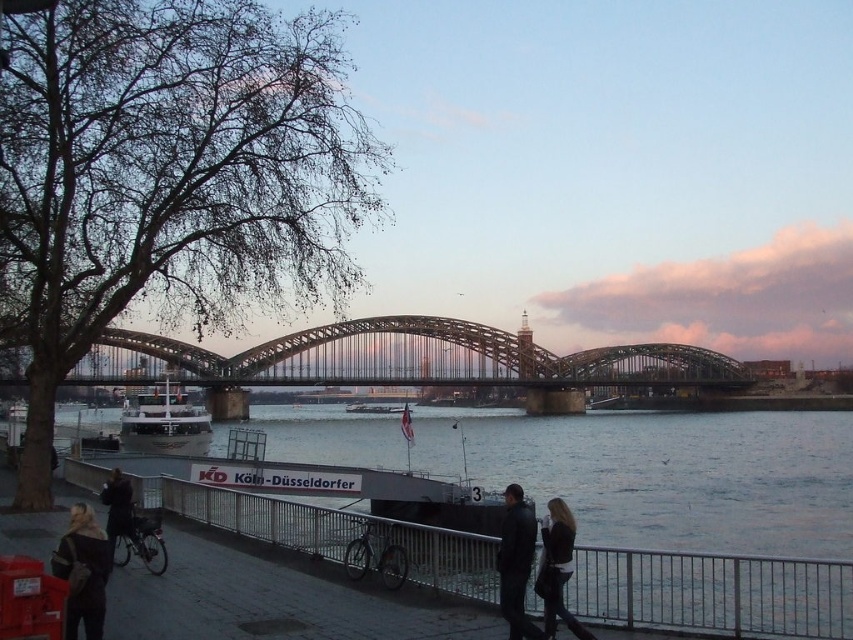
Question: Among these objects, which one is farthest from the camera?

Choices:
 (A) brown fur coat at lower left
 (B) metallic steel bridge at center
 (C) white glossy boat at center

Answer: (C)

Question: Does blue water at lower center appear over shiny silver boat at center?

Choices:
 (A) no
 (B) yes

Answer: (A)

Question: Does black leather jacket at lower right have a larger size compared to dark brown leather jacket at lower left?

Choices:
 (A) yes
 (B) no

Answer: (B)

Question: Is dark brown leather jacket at lower left further to the viewer compared to white glossy boat at center?

Choices:
 (A) no
 (B) yes

Answer: (A)

Question: Considering the real-world distances, which object is farthest from the brown fur coat at lower left?

Choices:
 (A) black leather jacket at lower right
 (B) shiny silver boat at center

Answer: (B)

Question: Which object is the closest to the metallic steel bridge at center?

Choices:
 (A) blue water at lower center
 (B) brown fur coat at lower left
 (C) dark brown leather jacket at lower left
 (D) white glossy boat at center

Answer: (D)